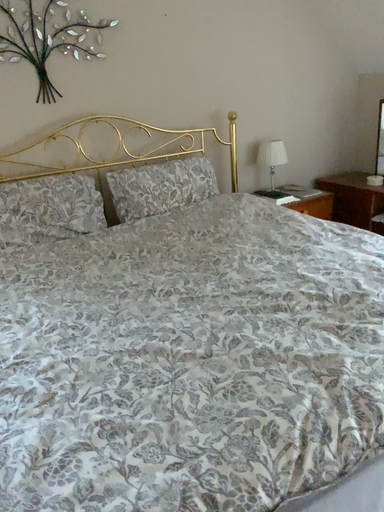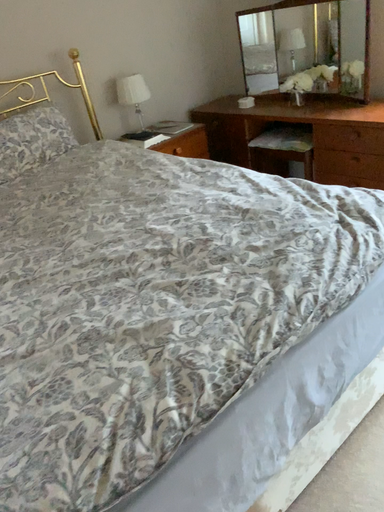
Question: How did the camera likely rotate when shooting the video?

Choices:
 (A) rotated left
 (B) rotated right

Answer: (B)